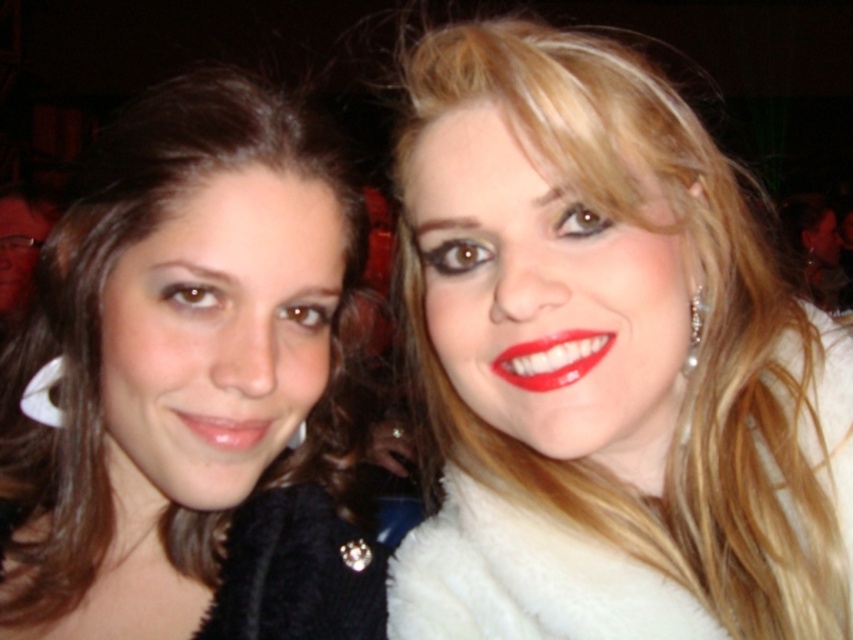
Question: Does white fur coat at right appear over matte black fur coat at left?

Choices:
 (A) no
 (B) yes

Answer: (B)

Question: Among these objects, which one is nearest to the camera?

Choices:
 (A) matte black fur coat at left
 (B) matte pink lipstick at lower left

Answer: (A)

Question: Which object is the closest to the matte pink lipstick at lower left?

Choices:
 (A) white fur coat at right
 (B) matte black fur coat at left
 (C) matte red lipstick at center

Answer: (B)

Question: Which point is farther to the camera?

Choices:
 (A) (234, 435)
 (B) (401, 132)
 (C) (572, 339)

Answer: (B)

Question: Is white fur coat at right above matte pink lipstick at lower left?

Choices:
 (A) yes
 (B) no

Answer: (A)

Question: Can you confirm if white fur coat at right is wider than matte red lipstick at center?

Choices:
 (A) yes
 (B) no

Answer: (A)